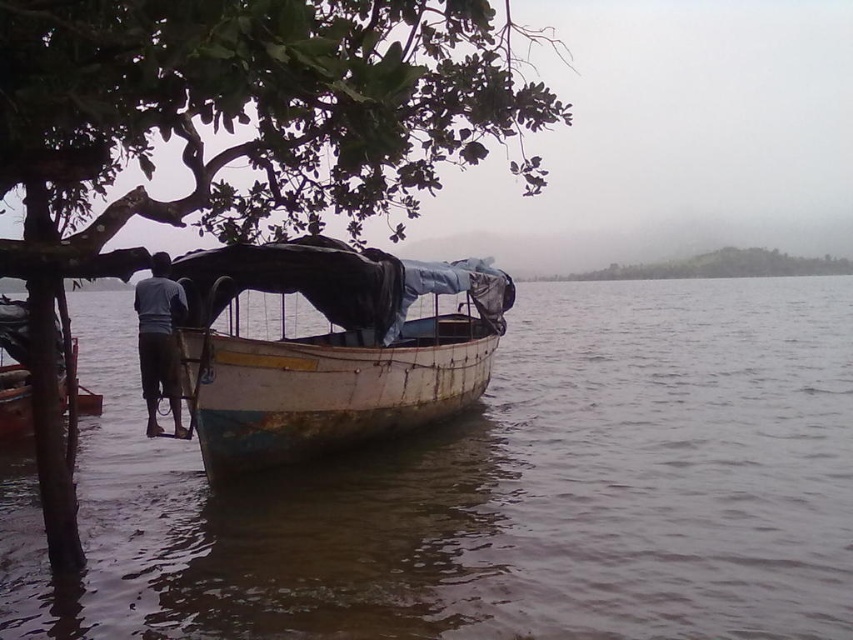
Question: Does brown murky water at boat left have a larger size compared to green leafy tree at upper left?

Choices:
 (A) yes
 (B) no

Answer: (B)

Question: Which object is farther from the camera taking this photo?

Choices:
 (A) brown murky water at boat left
 (B) dark blue fabric at left
 (C) green leafy tree at upper center

Answer: (C)

Question: Which object is the farthest from the brown murky water at boat left?

Choices:
 (A) wooden boat at center
 (B) green leafy tree at upper center
 (C) green leafy tree at upper left

Answer: (B)

Question: Does green leafy tree at upper left appear on the right side of wooden boat at center?

Choices:
 (A) no
 (B) yes

Answer: (A)

Question: Can you confirm if wooden boat at center is bigger than green leafy tree at upper center?

Choices:
 (A) yes
 (B) no

Answer: (B)

Question: Which object is positioned farthest from the green leafy tree at upper center?

Choices:
 (A) dark blue fabric at left
 (B) brown murky water at boat left
 (C) green leafy tree at upper left
 (D) wooden boat at center

Answer: (A)